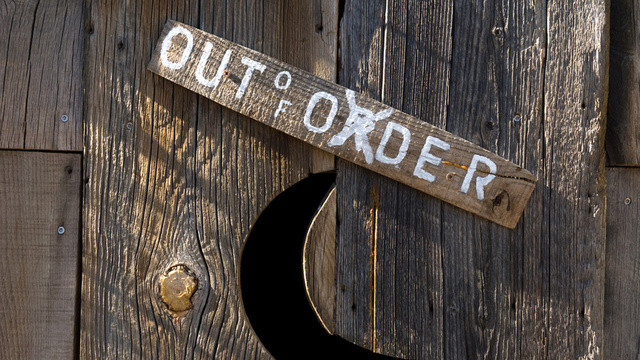
Find the location of `knot in wood`. knot in wood is located at coordinates (188, 290).